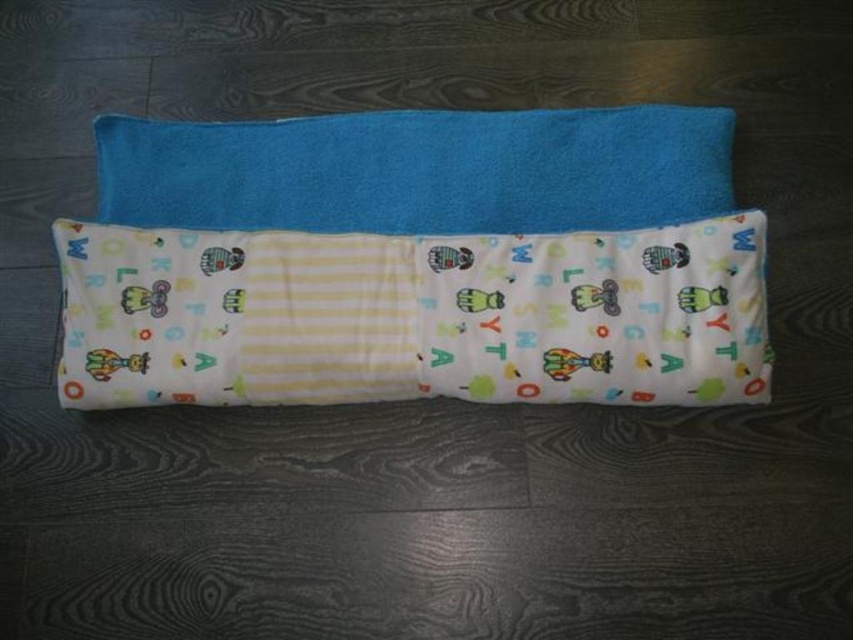
You are a photographer standing 1.5 meters away from the camera. You want to take a closeup shot of the white cotton blanket at center. Can you reach it without moving your feet?

The white cotton blanket at center is 1.22 meters away from the camera. Since you are standing 1.5 meters away from the camera, you are 0.28 meters farther than the blanket. Therefore, you can reach it without moving your feet by extending your arm or using a camera with a zoom lens.

You need to cover a small basket with a fabric that has an educational design. The basket is currently on the dark wooden surface. Which fabric should you choose between the white cotton blanket at center and the blue soft towel at center?

The white cotton blanket at center has the educational design with animal and letter illustrations, making it the appropriate choice for covering the basket.

You are organizing a childrens play area and need to arrange the white cotton blanket at center and the blue soft towel at center. According to the image, which one is positioned to the right?

The blue soft towel at center is positioned to the right of the white cotton blanket at center.